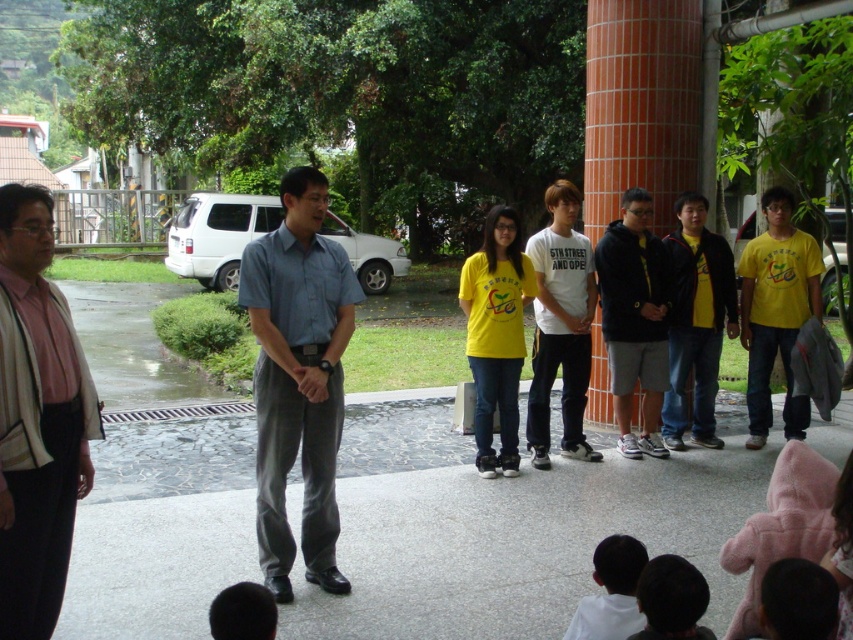
Based on the photo, you are standing at the point marked by coordinates point [299,378]. Which object is directly in front of you?

The point [299,378] marks light blue fabric shirt at center, so the light blue fabric shirt at center is directly in front of you.

You are a photographer trying to capture a group photo of the two speakers in the scene. The light blue fabric shirt at center and yellow matte shirt at center are both part of the group. Based on their positions, which speaker should you focus on first to ensure they are in the frame?

The light blue fabric shirt at center should be focused on first since it is taller than the yellow matte shirt at center, ensuring it is centered in the frame.